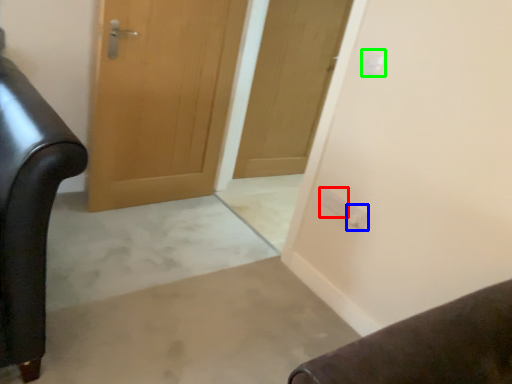
Question: Which object is the closest to the electric outlet (highlighted by a red box)? Choose among these: electric outlet (highlighted by a blue box) or electric outlet (highlighted by a green box).

Choices:
 (A) electric outlet
 (B) electric outlet

Answer: (A)